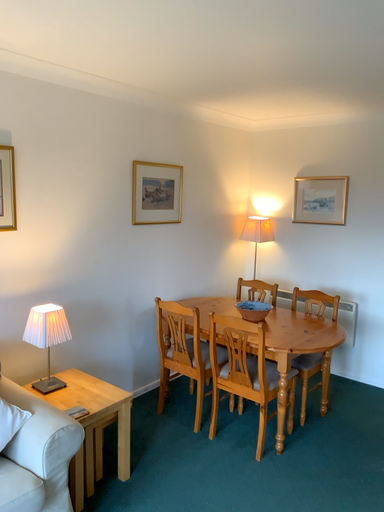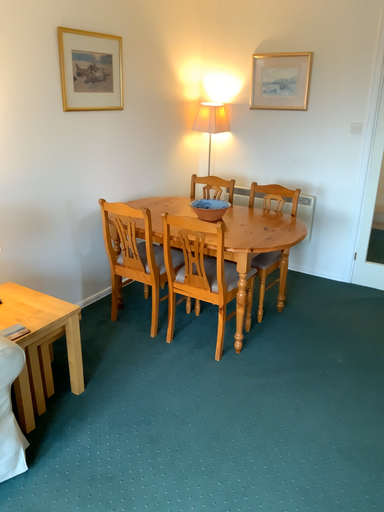
Question: How did the camera likely rotate when shooting the video?

Choices:
 (A) rotated left
 (B) rotated right

Answer: (B)